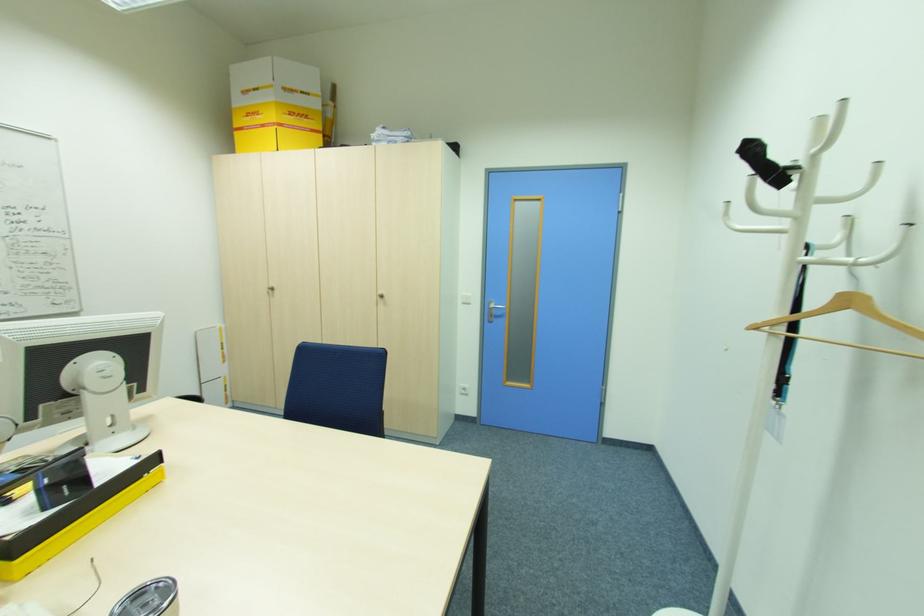
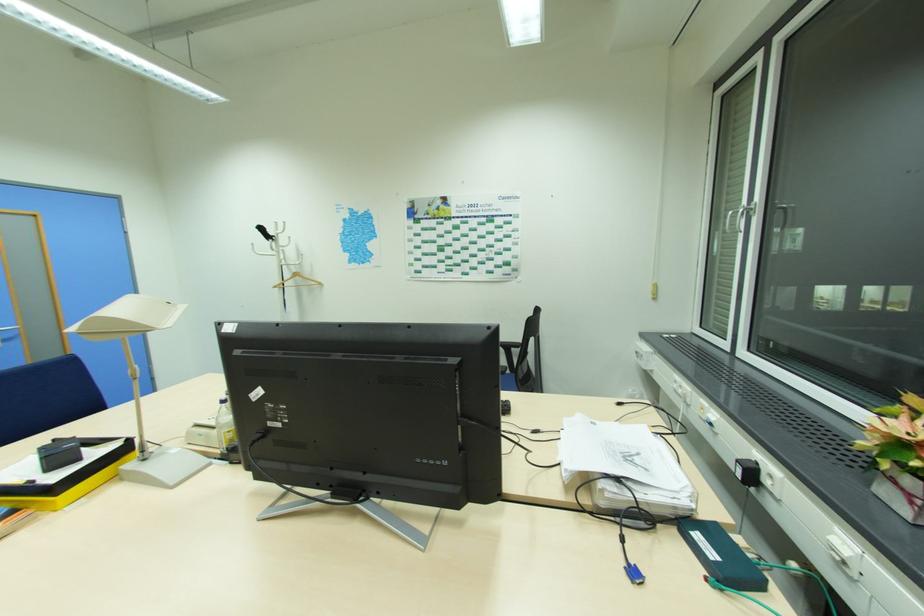
In the second image, find the point that corresponds to the point at 803,166 in the first image.

(276, 237)